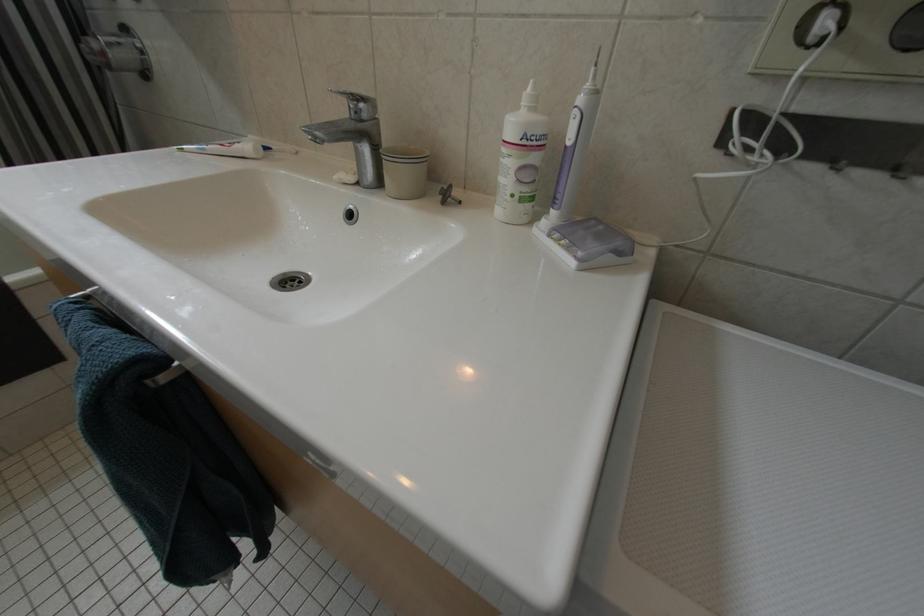
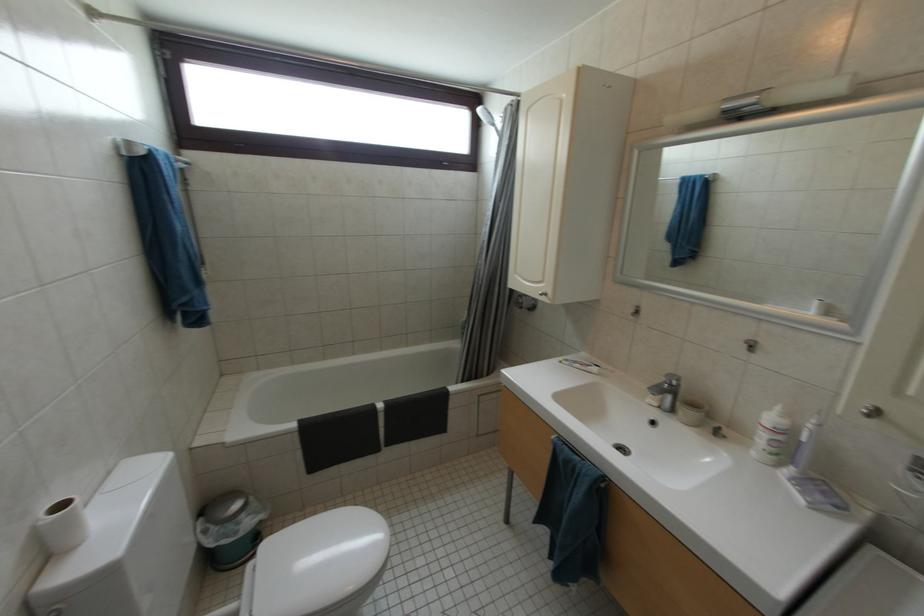
Based on the continuous images, in which direction is the camera rotating?

The camera rotated toward left-up.